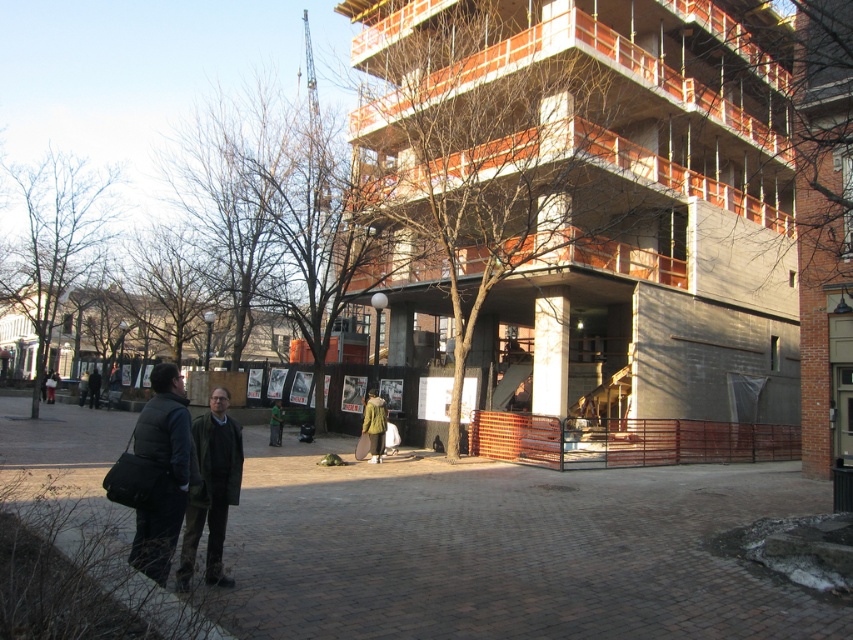
Question: Does brown wooden tree at upper center come in front of dark green fabric jacket at center?

Choices:
 (A) yes
 (B) no

Answer: (B)

Question: Can you confirm if bare wood tree at center is positioned below dark green fabric jacket at center?

Choices:
 (A) no
 (B) yes

Answer: (A)

Question: Which object appears farthest from the camera in this image?

Choices:
 (A) green fabric jacket at center
 (B) bare branches at left
 (C) brick pavement at lower center

Answer: (B)

Question: Can you confirm if dark gray puffer vest at center is bigger than dark gray jacket at lower left?

Choices:
 (A) yes
 (B) no

Answer: (B)

Question: Which object appears farthest from the camera in this image?

Choices:
 (A) green fabric jacket at center
 (B) bare wood tree at center
 (C) green fuzzy coat at center

Answer: (A)

Question: Which point is farther to the camera?

Choices:
 (A) dark green fabric jacket at center
 (B) green fuzzy coat at center
 (C) bare branches at left
 (D) brick pavement at lower center

Answer: (C)